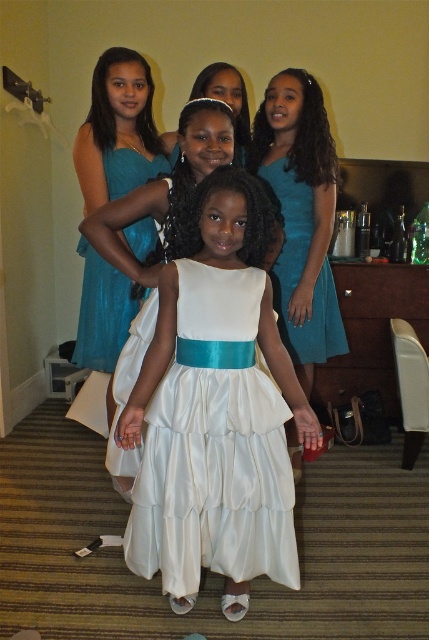
Question: Can you confirm if teal satin dress at upper center is positioned below teal satin dress at center?

Choices:
 (A) yes
 (B) no

Answer: (A)

Question: Considering the real-world distances, which object is farthest from the teal satin dress at upper center?

Choices:
 (A) white satin dress at center
 (B) teal satin dress at center

Answer: (A)

Question: Can you confirm if white satin dress at center is positioned to the right of teal satin dress at upper center?

Choices:
 (A) no
 (B) yes

Answer: (B)

Question: Is white satin dress at center positioned behind teal satin dress at center?

Choices:
 (A) yes
 (B) no

Answer: (B)

Question: Based on their relative distances, which object is farther from the white satin dress at center?

Choices:
 (A) teal satin dress at upper center
 (B) teal satin dress at center

Answer: (B)

Question: Which point is farther from the camera taking this photo?

Choices:
 (A) (210, 563)
 (B) (290, 285)

Answer: (B)